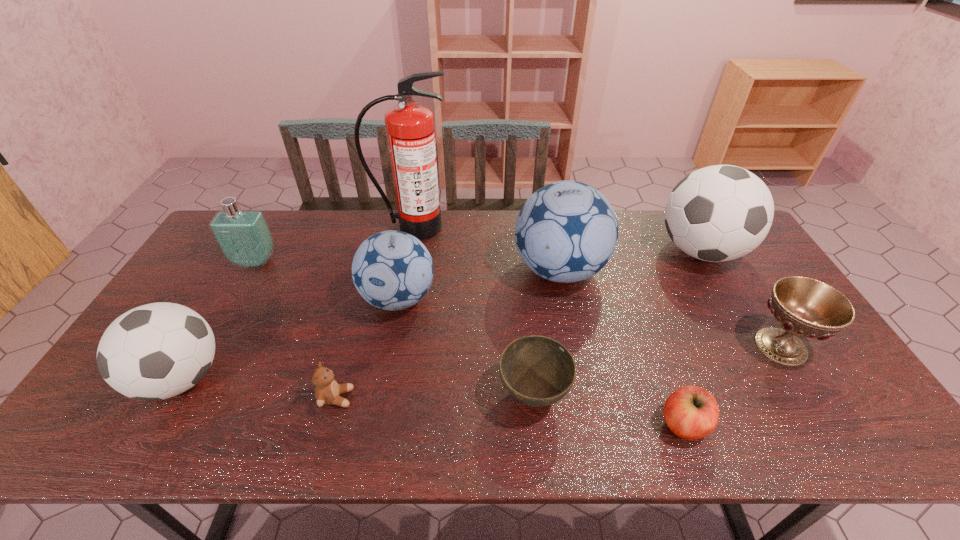
Find the location of a particular element. free spot between the leftmost soccer ball and the brown teddy bear is located at coordinates (259, 388).

Image resolution: width=960 pixels, height=540 pixels. I want to click on vacant space that's between the brown teddy bear and the leftmost soccer ball, so click(259, 388).

In order to click on empty location between the bowl and the apple in this screenshot , I will do `click(609, 409)`.

Find the location of `vacant region between the second soccer ball from right to left and the left black soccer ball`. vacant region between the second soccer ball from right to left and the left black soccer ball is located at coordinates point(371,325).

The width and height of the screenshot is (960, 540). What are the coordinates of `object that stands as the eighth closest to the brown teddy bear` in the screenshot? It's located at (718, 213).

Point out which object is positioned as the seventh nearest to the apple. Please provide its 2D coordinates. Your answer should be formatted as a tuple, i.e. [(x, y)], where the tuple contains the x and y coordinates of a point satisfying the conditions above.

[(410, 130)]

Select which soccer ball appears as the fourth closest to the eighth object from left to right. Please provide its 2D coordinates. Your answer should be formatted as a tuple, i.e. [(x, y)], where the tuple contains the x and y coordinates of a point satisfying the conditions above.

[(156, 351)]

Identify which soccer ball is the third nearest to the apple. Please provide its 2D coordinates. Your answer should be formatted as a tuple, i.e. [(x, y)], where the tuple contains the x and y coordinates of a point satisfying the conditions above.

[(392, 270)]

I want to click on free space that satisfies the following two spatial constraints: 1. on the side with brand of the apple; 2. on the left side of the second soccer ball from right to left, so click(589, 424).

Identify the location of free space that satisfies the following two spatial constraints: 1. on the front-facing side of the teddy bear; 2. on the right side of the apple. Image resolution: width=960 pixels, height=540 pixels. (329, 424).